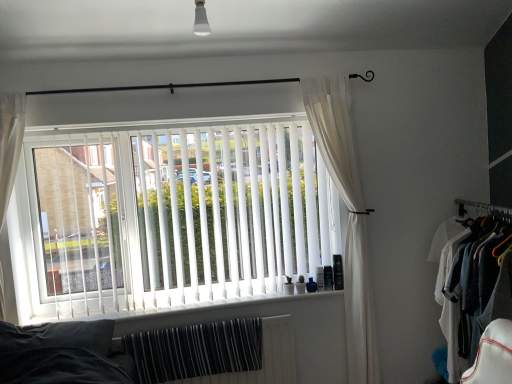
Question: From the image's perspective, is white sheer curtain at right over white cotton shirt at right?

Choices:
 (A) no
 (B) yes

Answer: (B)

Question: Can you confirm if white sheer curtain at right is thinner than white cotton shirt at right?

Choices:
 (A) no
 (B) yes

Answer: (B)

Question: Is white sheer curtain at right facing towards white cotton shirt at right?

Choices:
 (A) no
 (B) yes

Answer: (A)

Question: Does white sheer curtain at right touch white cotton shirt at right?

Choices:
 (A) yes
 (B) no

Answer: (B)

Question: Does white sheer curtain at right have a larger size compared to white cotton shirt at right?

Choices:
 (A) no
 (B) yes

Answer: (A)

Question: Considering the positions of white plastic window sill at center and white cotton shirt at right in the image, is white plastic window sill at center wider or thinner than white cotton shirt at right?

Choices:
 (A) thin
 (B) wide

Answer: (A)

Question: Considering their positions, is white plastic window sill at center located in front of or behind white cotton shirt at right?

Choices:
 (A) front
 (B) behind

Answer: (B)

Question: From the image's perspective, is white plastic window sill at center located above or below white cotton shirt at right?

Choices:
 (A) above
 (B) below

Answer: (B)

Question: Is point (327, 316) closer or farther from the camera than point (449, 372)?

Choices:
 (A) closer
 (B) farther

Answer: (B)

Question: From a real-world perspective, is white cotton shirt at right above or below white plastic window sill at center?

Choices:
 (A) above
 (B) below

Answer: (B)

Question: In terms of width, does white cotton shirt at right look wider or thinner when compared to white plastic window sill at center?

Choices:
 (A) thin
 (B) wide

Answer: (B)

Question: Considering their positions, is white cotton shirt at right located in front of or behind white plastic window sill at center?

Choices:
 (A) behind
 (B) front

Answer: (B)

Question: Is white cotton shirt at right bigger or smaller than white plastic window sill at center?

Choices:
 (A) small
 (B) big

Answer: (B)

Question: Looking at their shapes, would you say black metal rod at upper center is wider or thinner than white plastic window sill at center?

Choices:
 (A) thin
 (B) wide

Answer: (A)

Question: Is black metal rod at upper center taller or shorter than white plastic window sill at center?

Choices:
 (A) short
 (B) tall

Answer: (B)